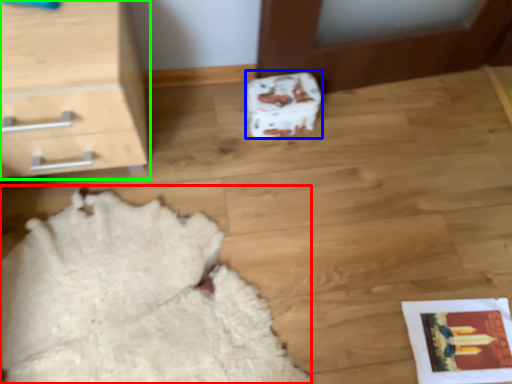
Question: Considering the real-world distances, which object is farthest from blanket (highlighted by a red box)? shoe box (highlighted by a blue box) or chest of drawers (highlighted by a green box)?

Choices:
 (A) shoe box
 (B) chest of drawers

Answer: (A)